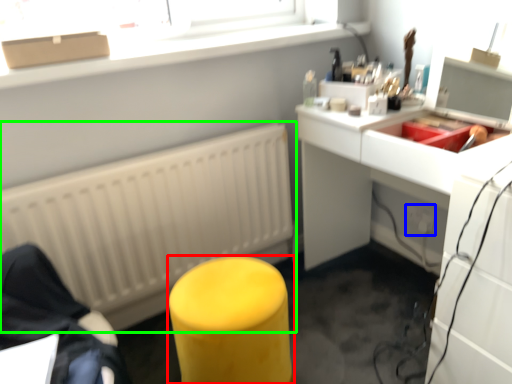
Question: Which object is the farthest from furniture (highlighted by a red box)? Choose among these: electric outlet (highlighted by a blue box) or radiator (highlighted by a green box).

Choices:
 (A) electric outlet
 (B) radiator

Answer: (A)